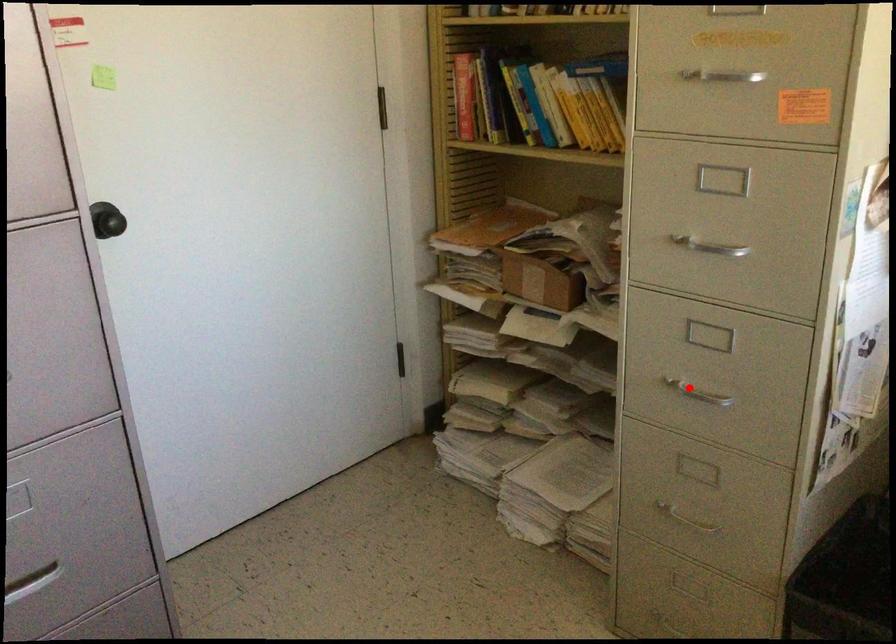
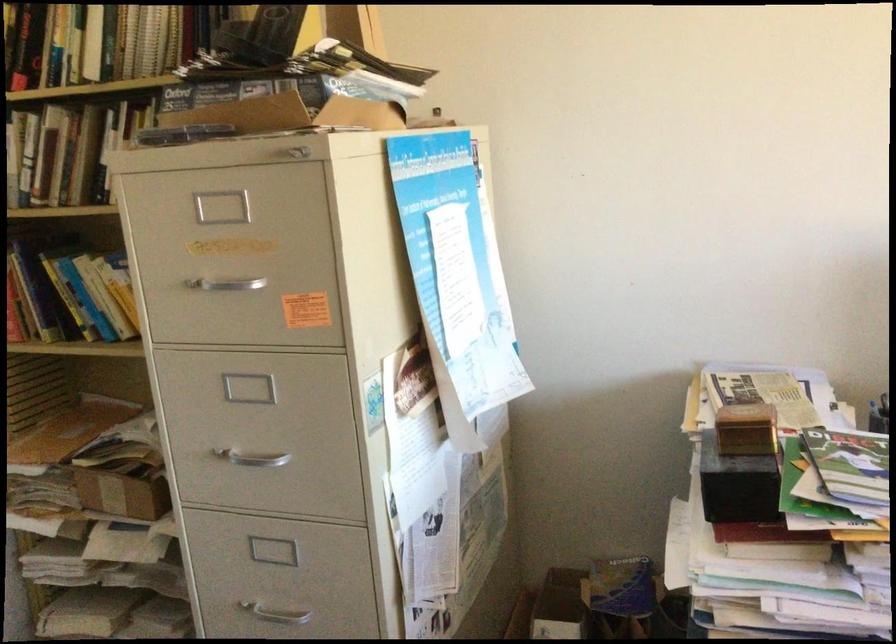
Find the pixel in the second image that matches the highlighted location in the first image.

(273, 608)